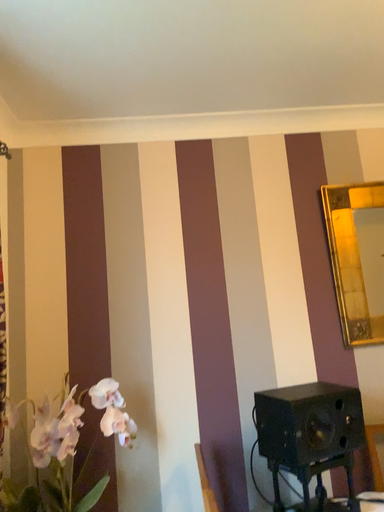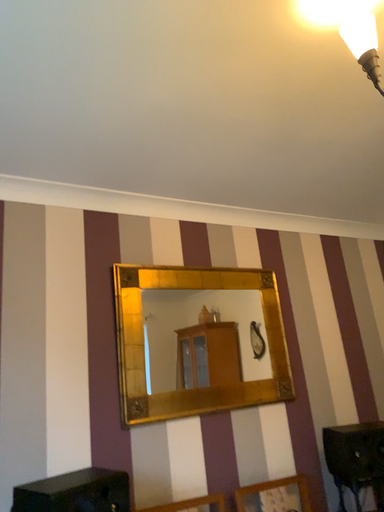
Question: How did the camera likely rotate when shooting the video?

Choices:
 (A) rotated right
 (B) rotated left

Answer: (A)